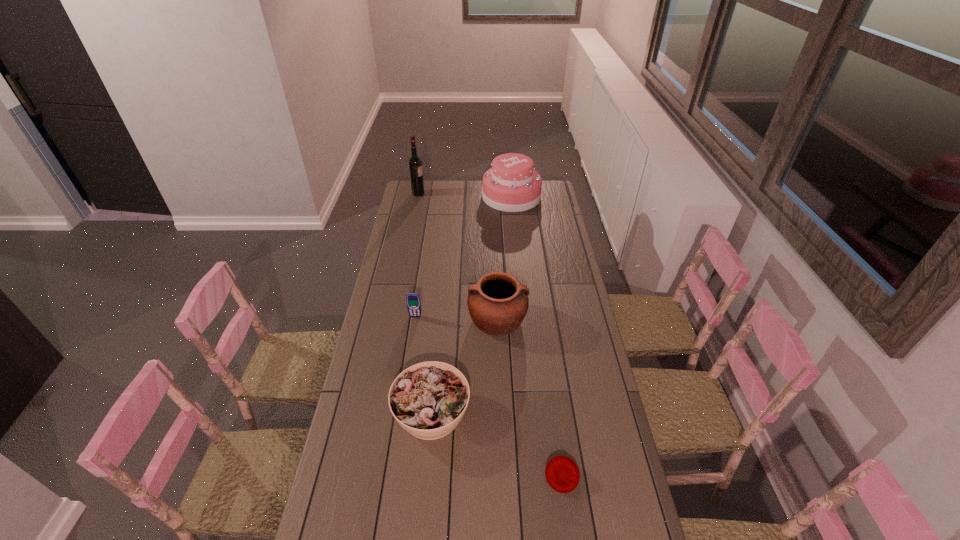
Find the location of a particular element. This screenshot has height=540, width=960. beanbag present at the right edge is located at coordinates (562, 474).

Identify the location of object at the far left corner. The width and height of the screenshot is (960, 540). (415, 162).

Identify the location of object that is at the far right corner. (512, 185).

Identify the location of vacant space at the far edge of the desktop. Image resolution: width=960 pixels, height=540 pixels. (474, 184).

Find the location of a particular element. This screenshot has width=960, height=540. blank space at the left edge of the desktop is located at coordinates (407, 225).

This screenshot has width=960, height=540. Identify the location of vacant region at the right edge of the desktop. (594, 350).

At what (x,y) coordinates should I click in order to perform the action: click on vacant space at the far left corner of the desktop. Please return your answer as a coordinate pair (x, y). This screenshot has width=960, height=540. Looking at the image, I should click on (430, 180).

Identify the location of free space between the cake and the beanbag. This screenshot has height=540, width=960. (537, 336).

Where is `free space between the tallest object and the fifth farthest object`? free space between the tallest object and the fifth farthest object is located at coordinates (425, 303).

Find the location of a particular element. The width and height of the screenshot is (960, 540). unoccupied position between the salad and the wine bottle is located at coordinates (425, 303).